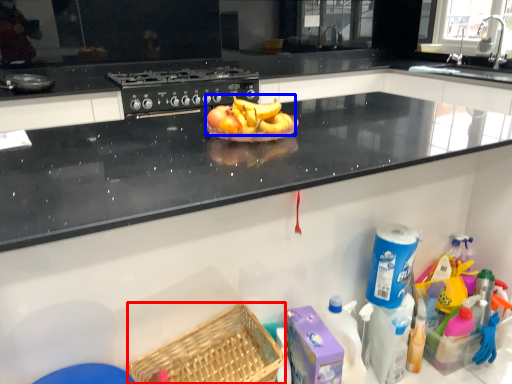
Question: Which of the following is the farthest to the observer, basket (highlighted by a red box) or banana (highlighted by a blue box)?

Choices:
 (A) basket
 (B) banana

Answer: (B)